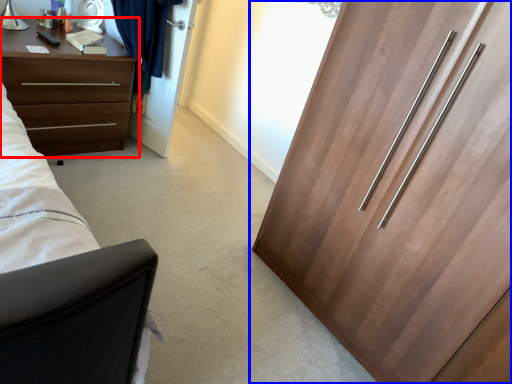
Question: Among these objects, which one is farthest to the camera, chest of drawers (highlighted by a red box) or cupboard (highlighted by a blue box)?

Choices:
 (A) chest of drawers
 (B) cupboard

Answer: (A)